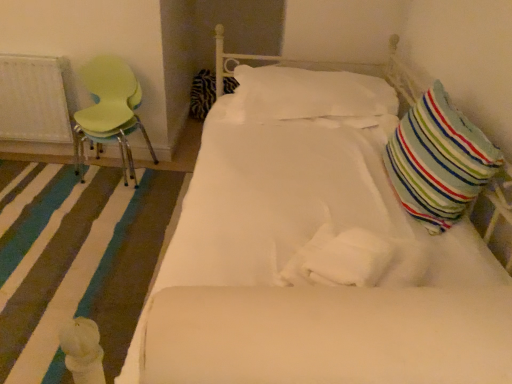
Question: Is light green plastic chair at left placed right next to striped fabric pillow at right, the 3th pillow when ordered from left to right?

Choices:
 (A) no
 (B) yes

Answer: (A)

Question: Does light green plastic chair at left turn towards striped fabric pillow at right, the third pillow positioned from the back?

Choices:
 (A) yes
 (B) no

Answer: (B)

Question: Considering the relative positions of light green plastic chair at left and striped fabric pillow at right, the 1th pillow from the front, in the image provided, is light green plastic chair at left to the right of striped fabric pillow at right, the 1th pillow from the front, from the viewer's perspective?

Choices:
 (A) no
 (B) yes

Answer: (A)

Question: Considering the relative sizes of light green plastic chair at left and striped fabric pillow at right, placed as the 1th pillow when sorted from right to left, in the image provided, is light green plastic chair at left wider than striped fabric pillow at right, placed as the 1th pillow when sorted from right to left,?

Choices:
 (A) no
 (B) yes

Answer: (B)

Question: Does light green plastic chair at left appear on the left side of striped fabric pillow at right, the 3th pillow when ordered from left to right?

Choices:
 (A) yes
 (B) no

Answer: (A)

Question: Does point [223, 82] appear closer or farther from the camera than point [62, 112]?

Choices:
 (A) closer
 (B) farther

Answer: (B)

Question: Relative to white textured radiator at left, is zebra-patterned fabric pillow at center-left, placed as the 3th pillow when sorted from right to left, in front or behind?

Choices:
 (A) front
 (B) behind

Answer: (B)

Question: In terms of size, does zebra-patterned fabric pillow at center-left, placed as the 3th pillow when sorted from right to left, appear bigger or smaller than white textured radiator at left?

Choices:
 (A) big
 (B) small

Answer: (A)

Question: From the image's perspective, is zebra-patterned fabric pillow at center-left, the third pillow from the front, located above or below white textured radiator at left?

Choices:
 (A) above
 (B) below

Answer: (A)

Question: Is white fabric rug at lower left bigger or smaller than light green plastic chair at left?

Choices:
 (A) small
 (B) big

Answer: (A)

Question: Based on their positions, is white fabric rug at lower left located to the left or right of light green plastic chair at left?

Choices:
 (A) right
 (B) left

Answer: (B)

Question: From a real-world perspective, relative to light green plastic chair at left, is white fabric rug at lower left vertically above or below?

Choices:
 (A) above
 (B) below

Answer: (B)

Question: From the image's perspective, relative to light green plastic chair at left, is white fabric rug at lower left above or below?

Choices:
 (A) below
 (B) above

Answer: (A)

Question: Does point click(x=440, y=198) appear closer or farther from the camera than point click(x=57, y=96)?

Choices:
 (A) farther
 (B) closer

Answer: (B)

Question: Considering their positions, is striped fabric pillow at right, the third pillow positioned from the back, located in front of or behind white textured radiator at left?

Choices:
 (A) front
 (B) behind

Answer: (A)